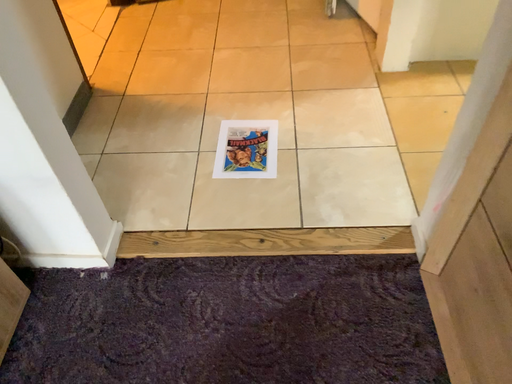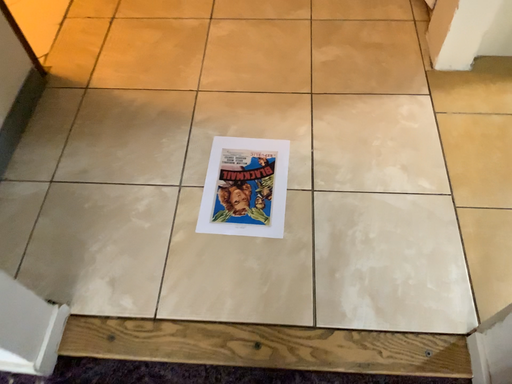
Question: How did the camera likely rotate when shooting the video?

Choices:
 (A) rotated downward
 (B) rotated upward

Answer: (A)